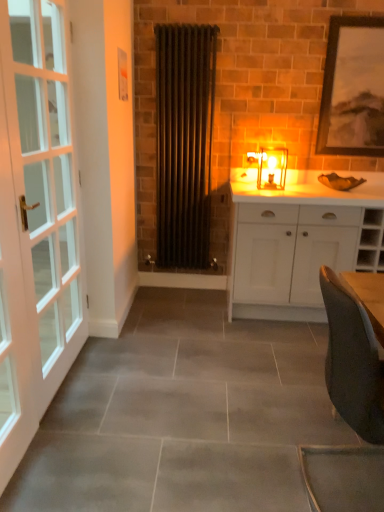
Question: From a real-world perspective, is matte glass candlestick at center physically above white matte cabinet at center?

Choices:
 (A) no
 (B) yes

Answer: (B)

Question: Considering the relative sizes of matte glass candlestick at center and white matte cabinet at center in the image provided, is matte glass candlestick at center taller than white matte cabinet at center?

Choices:
 (A) no
 (B) yes

Answer: (A)

Question: Is white matte cabinet at center completely or partially inside matte glass candlestick at center?

Choices:
 (A) no
 (B) yes

Answer: (A)

Question: Is matte glass candlestick at center in front of white matte cabinet at center?

Choices:
 (A) yes
 (B) no

Answer: (B)

Question: Considering the relative sizes of matte glass candlestick at center and white matte cabinet at center in the image provided, is matte glass candlestick at center thinner than white matte cabinet at center?

Choices:
 (A) no
 (B) yes

Answer: (B)

Question: Looking at the image, does matte black radiator at center seem bigger or smaller compared to matte glass candlestick at center?

Choices:
 (A) small
 (B) big

Answer: (B)

Question: Is matte black radiator at center in front of or behind matte glass candlestick at center in the image?

Choices:
 (A) front
 (B) behind

Answer: (A)

Question: Is matte black radiator at center inside or outside of matte glass candlestick at center?

Choices:
 (A) outside
 (B) inside

Answer: (A)

Question: From a real-world perspective, relative to matte glass candlestick at center, is matte black radiator at center vertically above or below?

Choices:
 (A) below
 (B) above

Answer: (B)

Question: Is white matte cabinet at center inside the boundaries of white glass door at left, or outside?

Choices:
 (A) inside
 (B) outside

Answer: (B)

Question: Is white matte cabinet at center taller or shorter than white glass door at left?

Choices:
 (A) short
 (B) tall

Answer: (A)

Question: Is white matte cabinet at center to the left or to the right of white glass door at left in the image?

Choices:
 (A) left
 (B) right

Answer: (B)

Question: Relative to white glass door at left, is white matte cabinet at center in front or behind?

Choices:
 (A) behind
 (B) front

Answer: (A)

Question: Do you think matte black radiator at center is within black matte picture frame at upper right, or outside of it?

Choices:
 (A) inside
 (B) outside

Answer: (B)

Question: Looking at the image, does matte black radiator at center seem bigger or smaller compared to black matte picture frame at upper right?

Choices:
 (A) big
 (B) small

Answer: (A)